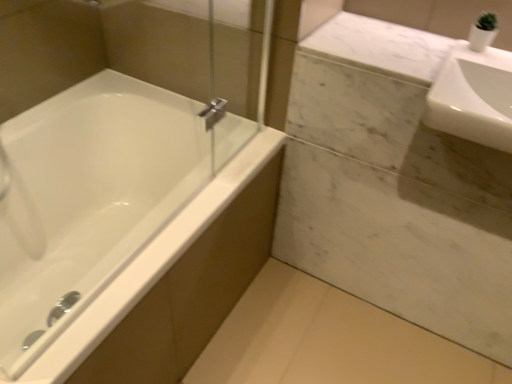
Question: Is white glossy sink at upper right bigger or smaller than white glossy bathtub at left?

Choices:
 (A) small
 (B) big

Answer: (A)

Question: In the image, is white glossy sink at upper right on the left side or the right side of white glossy bathtub at left?

Choices:
 (A) right
 (B) left

Answer: (A)

Question: Relative to white glossy bathtub at left, is white glossy sink at upper right in front or behind?

Choices:
 (A) front
 (B) behind

Answer: (B)

Question: Is white glossy bathtub at left in front of or behind white glossy sink at upper right in the image?

Choices:
 (A) behind
 (B) front

Answer: (B)

Question: Based on their sizes in the image, would you say white glossy bathtub at left is bigger or smaller than white glossy sink at upper right?

Choices:
 (A) big
 (B) small

Answer: (A)

Question: Considering the positions of point (68, 117) and point (486, 114), is point (68, 117) closer or farther from the camera than point (486, 114)?

Choices:
 (A) farther
 (B) closer

Answer: (A)

Question: In terms of height, does white glossy bathtub at left look taller or shorter compared to white glossy sink at upper right?

Choices:
 (A) short
 (B) tall

Answer: (B)